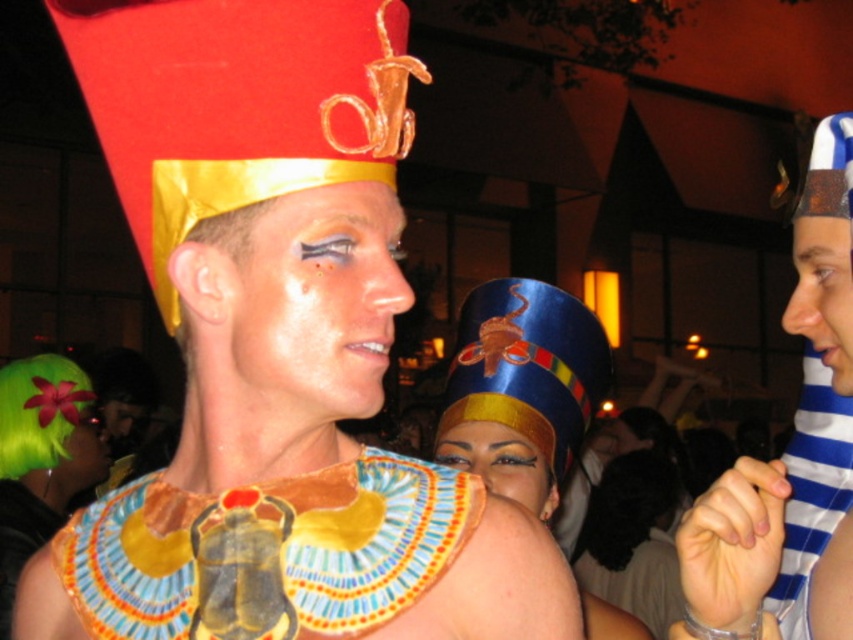
Is painted leather collar at center closer to the viewer compared to blue striped fabric at right?

No, painted leather collar at center is further to the viewer.

Which of these two, painted leather collar at center or blue striped fabric at right, stands taller?

With more height is blue striped fabric at right.

Is point (378, 516) farther from camera compared to point (764, 506)?

Yes, point (378, 516) is behind point (764, 506).

This screenshot has height=640, width=853. What are the coordinates of `painted leather collar at center` in the screenshot? It's located at pos(267,552).

Can you confirm if blue satin headdress at center is shorter than matte gold headdress at center?

No.

Which is in front, point (502, 371) or point (463, 465)?

Point (502, 371) is more forward.

Where is `blue satin headdress at center`? This screenshot has width=853, height=640. blue satin headdress at center is located at coordinates (521, 388).

In the scene shown: Is shiny gold face paint at center shorter than green fuzzy wig at lower left?

Indeed, shiny gold face paint at center has a lesser height compared to green fuzzy wig at lower left.

Between shiny gold face paint at center and green fuzzy wig at lower left, which one appears on the left side from the viewer's perspective?

Positioned to the left is green fuzzy wig at lower left.

What do you see at coordinates (314, 301) in the screenshot?
I see `shiny gold face paint at center` at bounding box center [314, 301].

Find the location of a particular element. This screenshot has height=640, width=853. shiny gold face paint at center is located at coordinates (x=314, y=301).